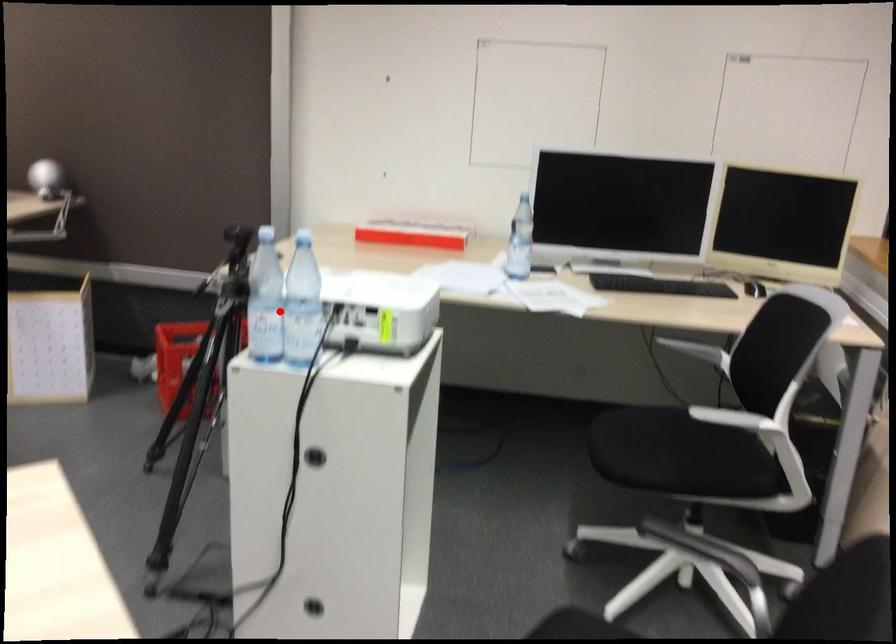
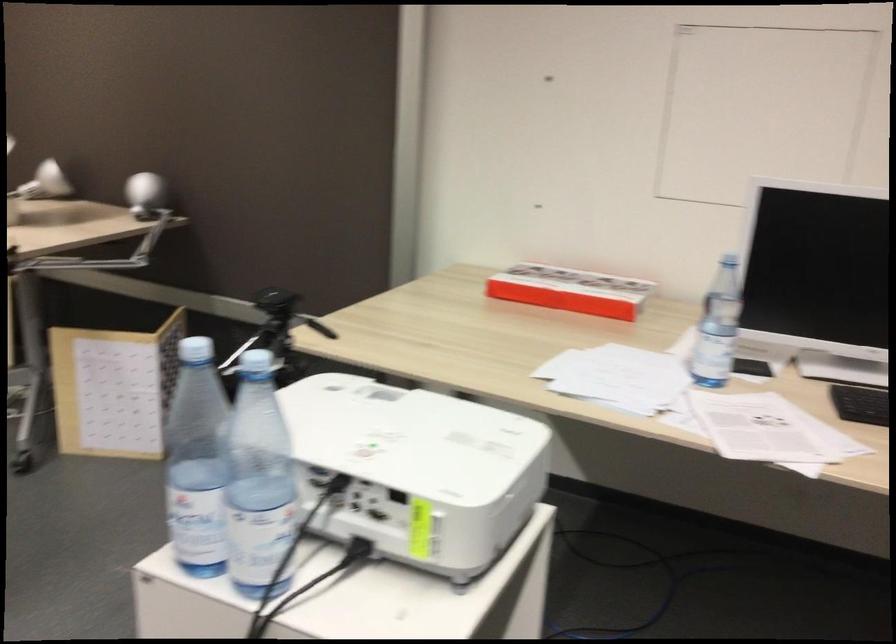
Find the pixel in the second image that matches the highlighted location in the first image.

(259, 482)